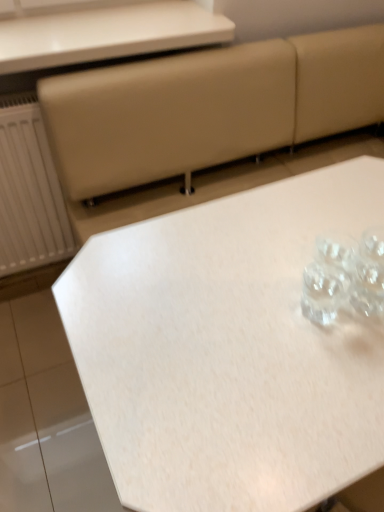
Question: Considering the relative sizes of white glossy table at upper center, marked as the first table in a top-to-bottom arrangement, and white matte table at center, the 1th table when ordered from bottom to top, in the image provided, is white glossy table at upper center, marked as the first table in a top-to-bottom arrangement, thinner than white matte table at center, the 1th table when ordered from bottom to top,?

Choices:
 (A) no
 (B) yes

Answer: (B)

Question: From the image's perspective, is white glossy table at upper center, marked as the first table in a top-to-bottom arrangement, above white matte table at center, the 1th table when ordered from bottom to top?

Choices:
 (A) yes
 (B) no

Answer: (A)

Question: Is white glossy table at upper center, marked as the first table in a top-to-bottom arrangement, positioned far away from white matte table at center, the 1th table when ordered from bottom to top?

Choices:
 (A) yes
 (B) no

Answer: (B)

Question: Can you see white glossy table at upper center, placed as the second table when sorted from bottom to top, touching white matte table at center, acting as the 2th table starting from the top?

Choices:
 (A) no
 (B) yes

Answer: (A)

Question: From the image's perspective, is white glossy table at upper center, marked as the first table in a top-to-bottom arrangement, beneath white matte table at center, acting as the 2th table starting from the top?

Choices:
 (A) no
 (B) yes

Answer: (A)

Question: Does white glossy table at upper center, placed as the second table when sorted from bottom to top, contain white matte table at center, the 1th table when ordered from bottom to top?

Choices:
 (A) no
 (B) yes

Answer: (A)

Question: Considering the relative positions of white matte table at center, acting as the 2th table starting from the top, and white glossy table at upper center, marked as the first table in a top-to-bottom arrangement, in the image provided, is white matte table at center, acting as the 2th table starting from the top, in front of white glossy table at upper center, marked as the first table in a top-to-bottom arrangement,?

Choices:
 (A) yes
 (B) no

Answer: (A)

Question: Considering the relative positions of white matte table at center, acting as the 2th table starting from the top, and white glossy table at upper center, marked as the first table in a top-to-bottom arrangement, in the image provided, is white matte table at center, acting as the 2th table starting from the top, to the left of white glossy table at upper center, marked as the first table in a top-to-bottom arrangement, from the viewer's perspective?

Choices:
 (A) no
 (B) yes

Answer: (A)

Question: From the image's perspective, is white matte table at center, the 1th table when ordered from bottom to top, below white glossy table at upper center, placed as the second table when sorted from bottom to top?

Choices:
 (A) no
 (B) yes

Answer: (B)

Question: Can you confirm if white matte table at center, the 1th table when ordered from bottom to top, is shorter than white glossy table at upper center, marked as the first table in a top-to-bottom arrangement?

Choices:
 (A) yes
 (B) no

Answer: (B)

Question: Is white glossy table at upper center, marked as the first table in a top-to-bottom arrangement, completely or partially inside white matte table at center, the 1th table when ordered from bottom to top?

Choices:
 (A) yes
 (B) no

Answer: (B)

Question: Can you confirm if white matte table at center, the 1th table when ordered from bottom to top, is bigger than white glossy table at upper center, marked as the first table in a top-to-bottom arrangement?

Choices:
 (A) no
 (B) yes

Answer: (B)

Question: Is point (188, 209) positioned closer to the camera than point (114, 53)?

Choices:
 (A) farther
 (B) closer

Answer: (B)